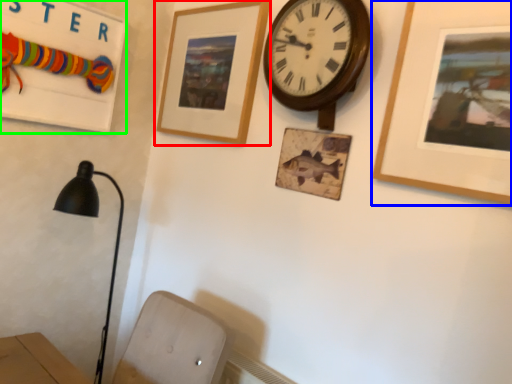
Question: Considering the real-world distances, which object is farthest from picture frame (highlighted by a red box)? picture frame (highlighted by a blue box) or bulletin board (highlighted by a green box)?

Choices:
 (A) picture frame
 (B) bulletin board

Answer: (A)